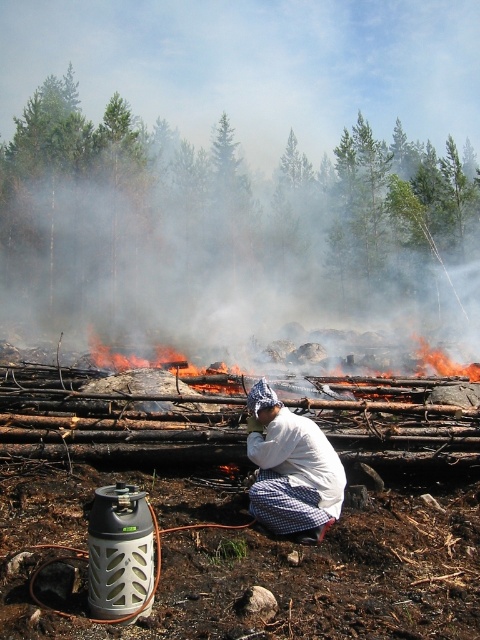
Question: Which point appears closest to the camera in this image?

Choices:
 (A) (301, 532)
 (B) (182, 371)

Answer: (A)

Question: Which point is closer to the camera taking this photo?

Choices:
 (A) [296, 448]
 (B) [154, 362]

Answer: (A)

Question: Can you confirm if white cotton shirt at center is positioned below flaming wood at center?

Choices:
 (A) no
 (B) yes

Answer: (B)

Question: Which point is closer to the camera taking this photo?

Choices:
 (A) (300, 486)
 (B) (425, 348)

Answer: (A)

Question: Is white cotton shirt at center to the left of flaming wood at center from the viewer's perspective?

Choices:
 (A) yes
 (B) no

Answer: (A)

Question: Is white cotton shirt at center below flaming wood at center?

Choices:
 (A) no
 (B) yes

Answer: (B)